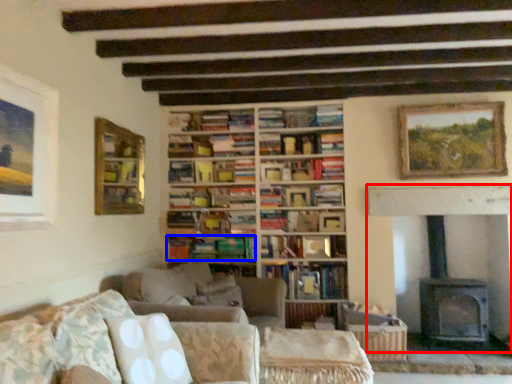
Question: Among these objects, which one is farthest to the camera, fireplace (highlighted by a red box) or book (highlighted by a blue box)?

Choices:
 (A) fireplace
 (B) book

Answer: (B)